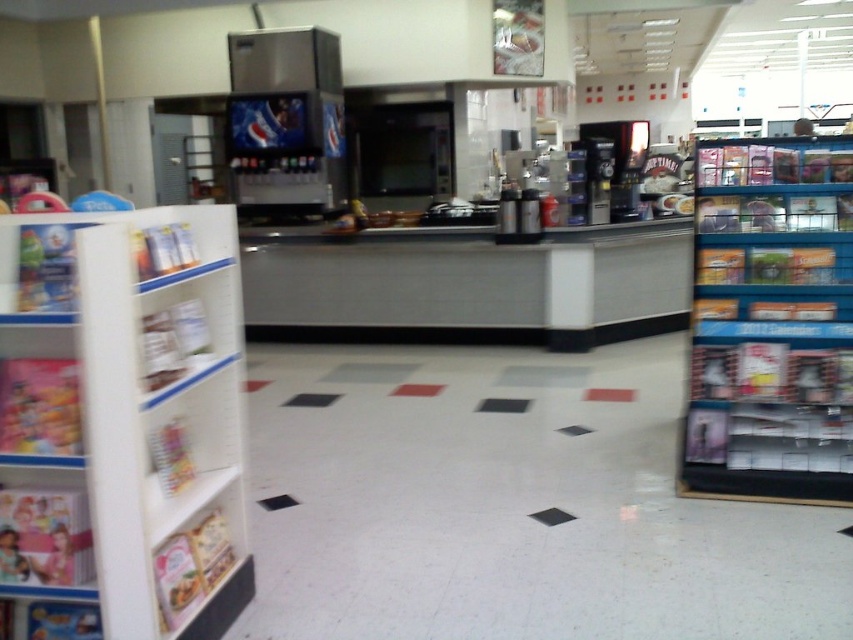
Does white cardboard shelf at left have a greater width compared to blue plastic shelves at right?

Incorrect, white cardboard shelf at left's width does not surpass blue plastic shelves at right's.

Who is more forward, (177, 410) or (747, 474)?

Positioned in front is point (177, 410).

Is point (138, 392) positioned in front of point (840, 364)?

Yes, point (138, 392) is closer to viewer.

Find the location of `white cardboard shelf at left`. white cardboard shelf at left is located at coordinates (122, 424).